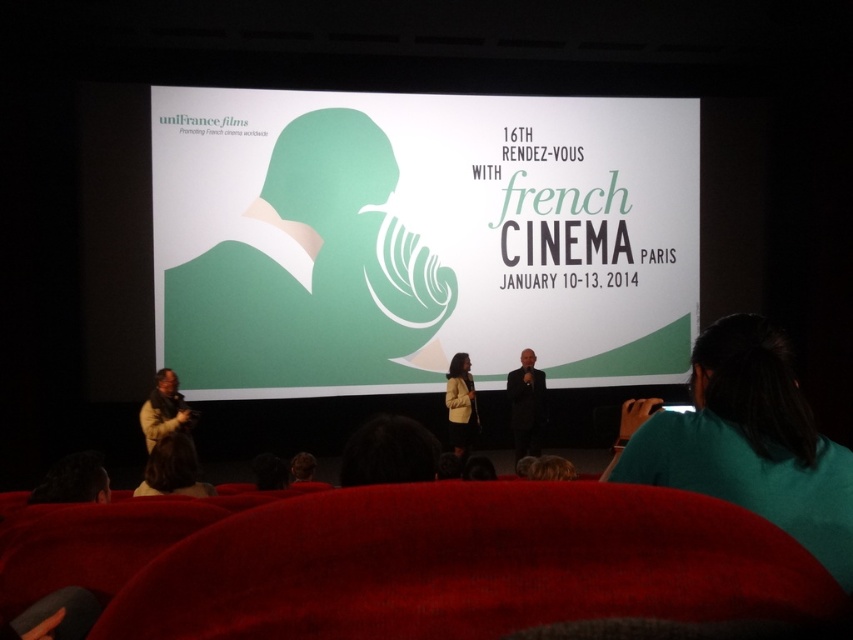
You are an event organizer who wants to place a new banner on the screen. The banner must be placed exactly at the point with coordinates [419,237]. What object will the banner overlap with?

The banner will overlap with the green paper at center because the point [419,237] corresponds to that object.

You are sitting in the theater and notice two points on the projection screen. The first point is at coordinates point(158, 413) and the second is at point(451, 413). Based on your vantage point, which of these points appears closer to you?

Point(158, 413) is closer to the viewer than point(451, 413).

You are an actor attending the 16th Rendezvous with French Cinema in Paris. You see a brown textured coat at left and a light brown leather jacket at center. Which one is higher up?

The brown textured coat at left is located above the light brown leather jacket at center, so the brown textured coat at left is higher up.